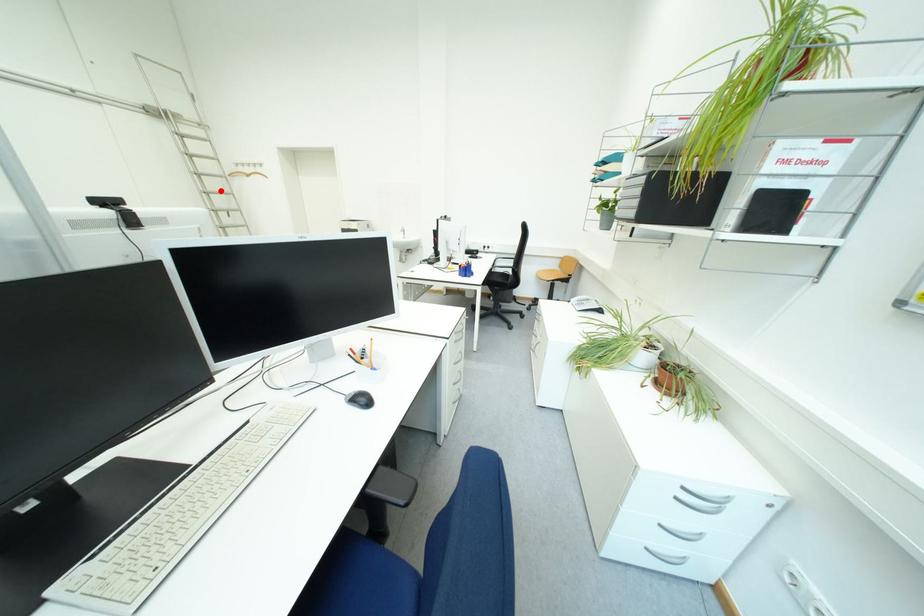
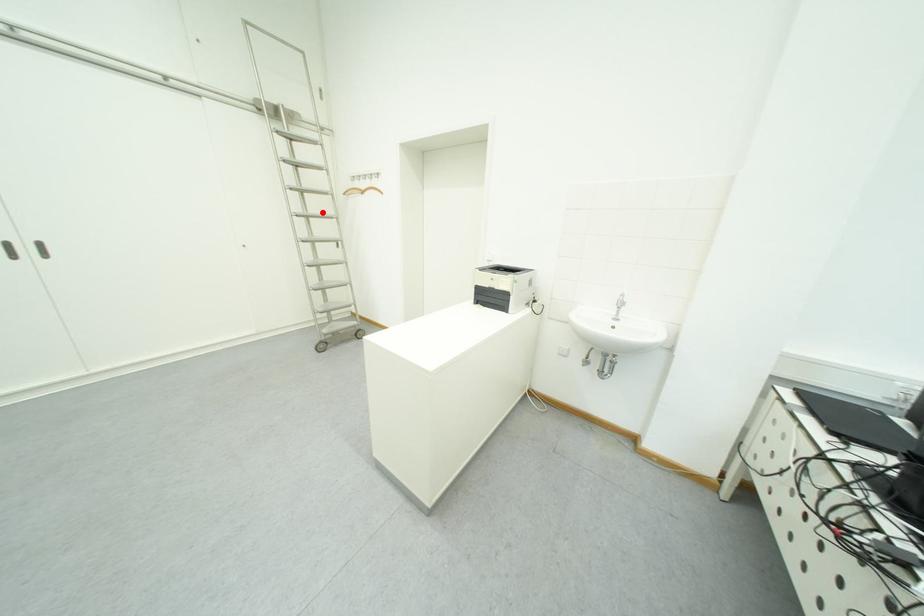
I am providing you with two images of the same scene from different viewpoints. A red point is marked on the first image and another point is marked on the second image. Do the highlighted points in image1 and image2 indicate the same real-world spot?

Yes